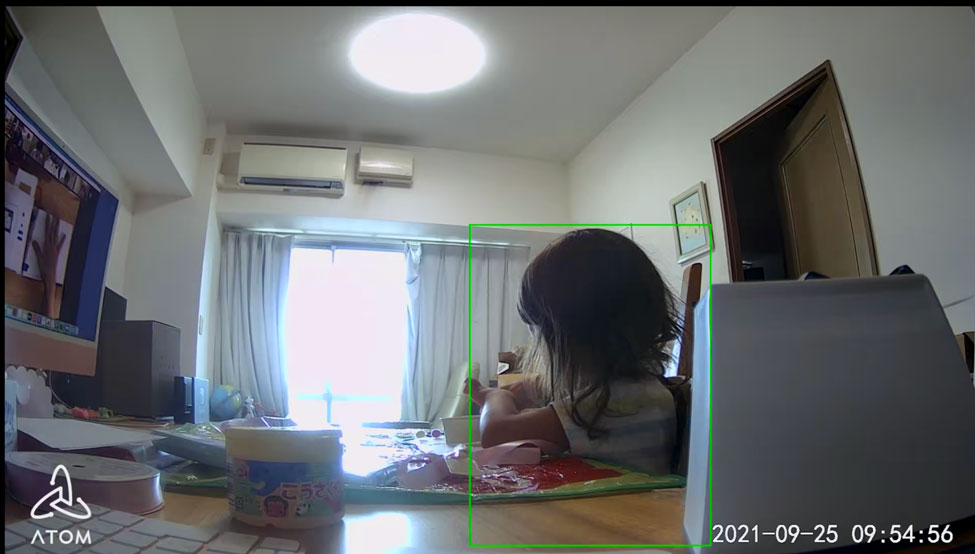
Where is `air conditioner`? The height and width of the screenshot is (554, 975). air conditioner is located at coordinates (289, 157).